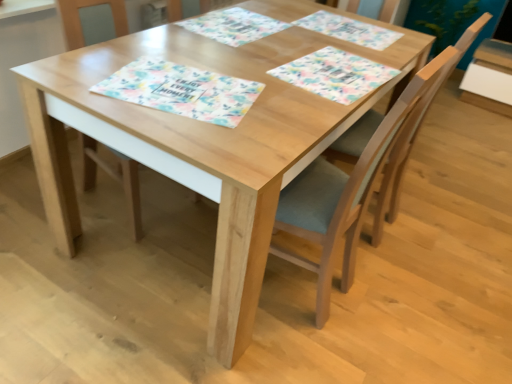
The height and width of the screenshot is (384, 512). I want to click on free space to the right of floral paper placemat at center, the first place mat viewed from the front, so click(x=290, y=100).